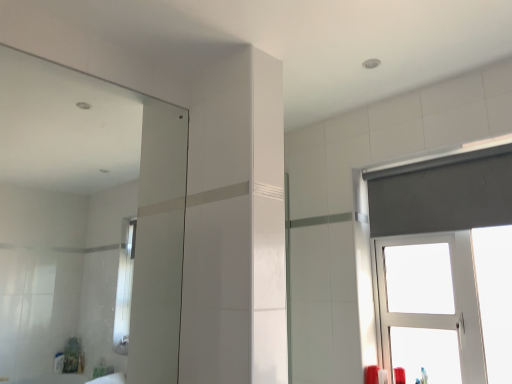
Question: From a real-world perspective, does white plastic window at upper right stand above clear glass mirror at upper left?

Choices:
 (A) no
 (B) yes

Answer: (A)

Question: Is white plastic window at upper right with clear glass mirror at upper left?

Choices:
 (A) yes
 (B) no

Answer: (B)

Question: Is white plastic window at upper right to the left of clear glass mirror at upper left from the viewer's perspective?

Choices:
 (A) no
 (B) yes

Answer: (A)

Question: Is white plastic window at upper right not within clear glass mirror at upper left?

Choices:
 (A) no
 (B) yes

Answer: (B)

Question: Is clear glass mirror at upper left completely or partially inside white plastic window at upper right?

Choices:
 (A) yes
 (B) no

Answer: (B)

Question: Is point (385, 377) positioned closer to the camera than point (95, 233)?

Choices:
 (A) farther
 (B) closer

Answer: (B)

Question: Is matte plastic toothbrush at lower right, the 2th toiletry viewed from the right, wider or thinner than clear glass mirror at upper left?

Choices:
 (A) wide
 (B) thin

Answer: (A)

Question: From the image's perspective, relative to clear glass mirror at upper left, is matte plastic toothbrush at lower right, the first toiletry in the left-to-right sequence, above or below?

Choices:
 (A) below
 (B) above

Answer: (A)

Question: From a real-world perspective, is matte plastic toothbrush at lower right, the first toiletry in the left-to-right sequence, physically located above or below clear glass mirror at upper left?

Choices:
 (A) below
 (B) above

Answer: (A)

Question: In terms of size, does clear glass mirror at upper left appear bigger or smaller than matte plastic toothbrush at lower right, the first toiletry in the left-to-right sequence?

Choices:
 (A) small
 (B) big

Answer: (B)

Question: Is clear glass mirror at upper left in front of or behind matte plastic toothbrush at lower right, the 2th toiletry viewed from the right, in the image?

Choices:
 (A) behind
 (B) front

Answer: (B)

Question: Is clear glass mirror at upper left to the left or to the right of matte plastic toothbrush at lower right, the first toiletry in the left-to-right sequence, in the image?

Choices:
 (A) right
 (B) left

Answer: (B)

Question: From a real-world perspective, is clear glass mirror at upper left physically located above or below matte plastic toothbrush at lower right, the first toiletry in the left-to-right sequence?

Choices:
 (A) above
 (B) below

Answer: (A)

Question: Is white plastic window at upper right situated inside matte plastic toothbrush at lower right, the first toiletry in the left-to-right sequence, or outside?

Choices:
 (A) outside
 (B) inside

Answer: (A)

Question: Is white plastic window at upper right taller or shorter than matte plastic toothbrush at lower right, the 2th toiletry viewed from the right?

Choices:
 (A) short
 (B) tall

Answer: (B)